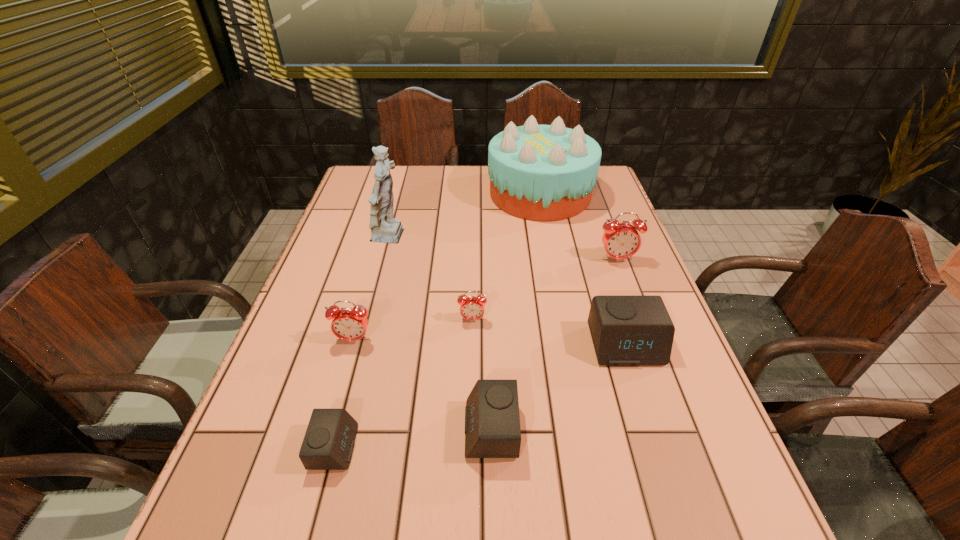
I want to click on blank space at the right edge of the desktop, so (x=717, y=502).

Image resolution: width=960 pixels, height=540 pixels. In order to click on free space between the tallest object and the second tallest object in this screenshot , I will do `click(466, 216)`.

Where is `free space between the second red alarm clock from left to right and the second black alarm clock from right to left`? free space between the second red alarm clock from left to right and the second black alarm clock from right to left is located at coordinates (482, 375).

Where is `vacant area that lies between the second biggest red alarm clock and the farthest object`? This screenshot has width=960, height=540. vacant area that lies between the second biggest red alarm clock and the farthest object is located at coordinates (446, 267).

Where is `free space between the second biggest red alarm clock and the second farthest red alarm clock`? free space between the second biggest red alarm clock and the second farthest red alarm clock is located at coordinates (413, 330).

I want to click on unoccupied position between the tallest object and the cake, so click(x=466, y=216).

You are a GUI agent. You are given a task and a screenshot of the screen. Output one action in this format:
    pyautogui.click(x=<x>, y=<y>)
    Task: Click on the free spot between the second biggest black alarm clock and the nearest red alarm clock
    The image size is (960, 540).
    Given the screenshot: What is the action you would take?
    pyautogui.click(x=422, y=385)

Locate an element on the screen. This screenshot has width=960, height=540. free space between the leftmost red alarm clock and the second biggest black alarm clock is located at coordinates (422, 385).

Where is `free point between the second farthest alarm clock and the sixth nearest object`? Image resolution: width=960 pixels, height=540 pixels. free point between the second farthest alarm clock and the sixth nearest object is located at coordinates (544, 289).

The width and height of the screenshot is (960, 540). I want to click on free space between the farthest red alarm clock and the second smallest black alarm clock, so click(554, 345).